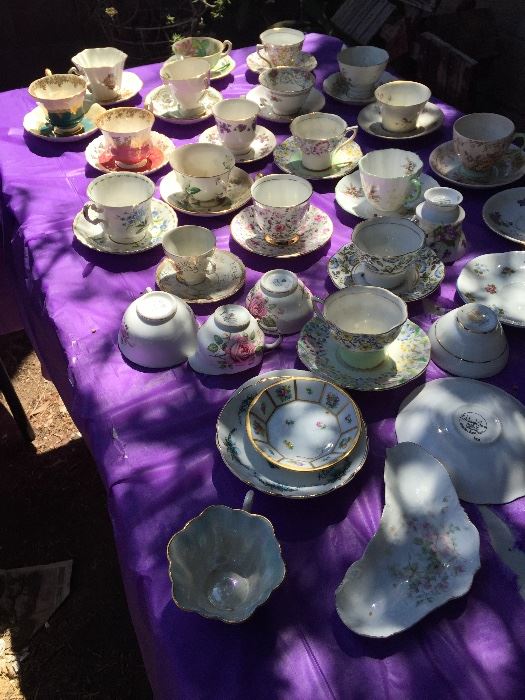
At what (x,y) coordinates should I click in order to perform the action: click on weirdly shaped plate. Please return your answer as a coordinate pair (x, y). Looking at the image, I should click on (403, 589).